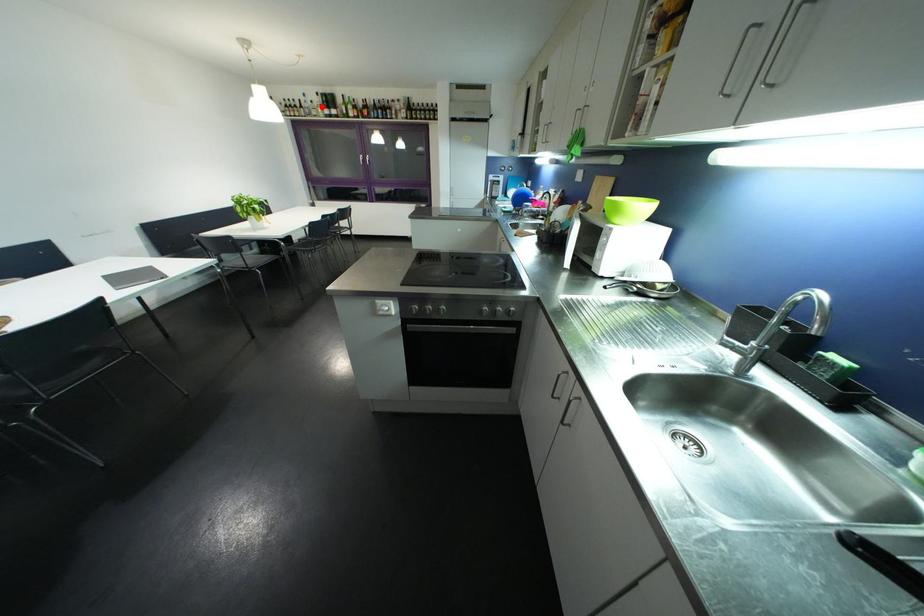
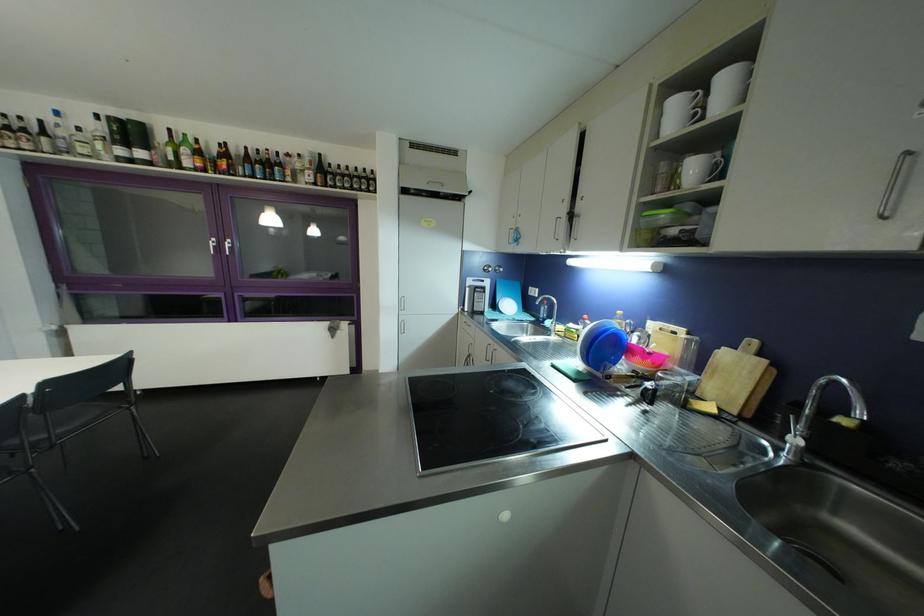
Question: I am providing you with two images of the same scene from different viewpoints. Given a red point in image1, look at the same physical point in image2. Is it:

Choices:
 (A) Closer to the viewpoint
 (B) Farther from the viewpoint

Answer: (B)